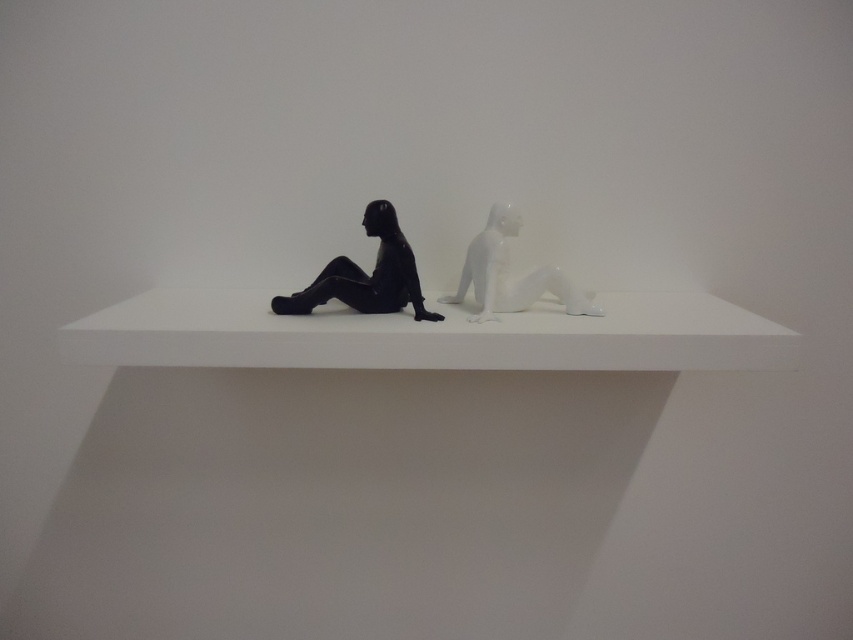
You are standing in front of a white shelf with two sculptures. The matte black figure at left and the white sculpture at right are both on the shelf. If you want to touch the closest sculpture to you, which one should you reach for?

The matte black figure at left is 3.93 feet away from viewer, so you should reach for the matte black figure at left since it is closer than the white sculpture at right.

Looking at this image, you are an art curator arranging a new exhibition. You have a white glossy ledge at center and a matte black figure at left in your collection. Which object is shorter in height?

The white glossy ledge at center is not as tall as the matte black figure at left, so the white glossy ledge at center is shorter in height.

You are an art curator arranging a new exhibition. You need to place a small label between the white glossy ledge at center and the matte black figure at left so visitors can easily read both labels from the front. Where should the label be placed?

The label should be placed on the white glossy ledge at center since it is in front of the matte black figure at left, ensuring visitors can easily see both labels from the front.